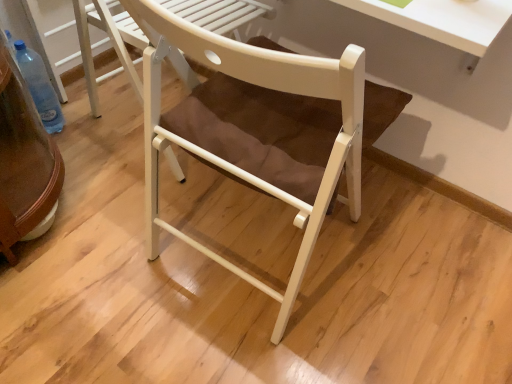
Where is `free location in front of transparent plastic bottle at lower left`? This screenshot has height=384, width=512. free location in front of transparent plastic bottle at lower left is located at coordinates (71, 160).